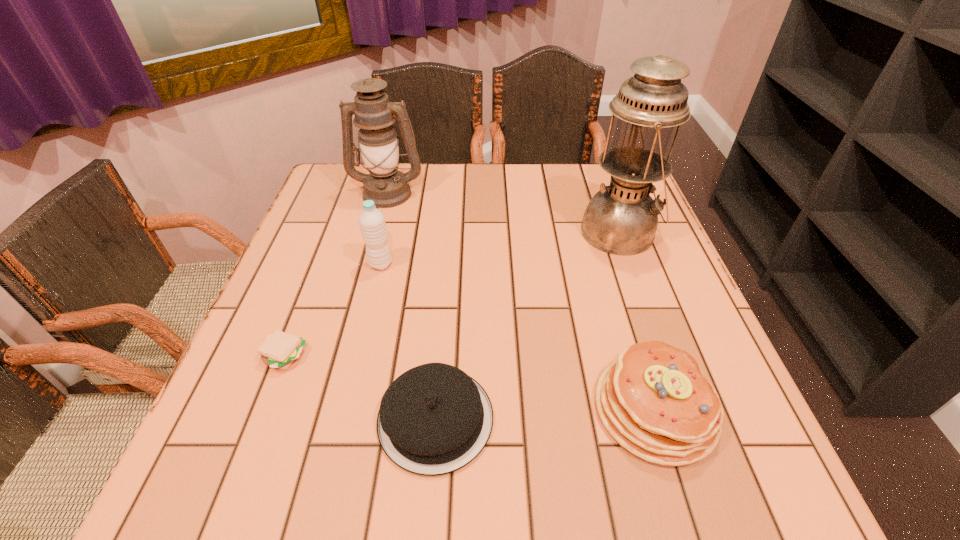
Where is `patty`? patty is located at coordinates (279, 350).

Where is `free location located 0.170m on the back of the fifth nearest object`? free location located 0.170m on the back of the fifth nearest object is located at coordinates (599, 176).

Locate an element on the screen. This screenshot has height=540, width=960. vacant region located on the right of the farther oil lamp is located at coordinates (490, 193).

The image size is (960, 540). In order to click on vacant region located 0.240m on the front of the third tallest object in this screenshot , I will do `click(357, 362)`.

I want to click on free space located 0.280m on the back of the taller pancake, so click(x=608, y=259).

At what (x,y) coordinates should I click in order to perform the action: click on free point located 0.220m on the back of the shorter pancake. Please return your answer as a coordinate pair (x, y). Looking at the image, I should click on (446, 285).

Locate an element on the screen. The width and height of the screenshot is (960, 540). free region located 0.390m on the back of the patty is located at coordinates (339, 219).

This screenshot has width=960, height=540. I want to click on object at the far edge, so click(374, 114).

What are the coordinates of `oil lamp that is positioned at the left edge` in the screenshot? It's located at (374, 114).

Image resolution: width=960 pixels, height=540 pixels. In order to click on patty that is at the left edge in this screenshot , I will do [x=279, y=350].